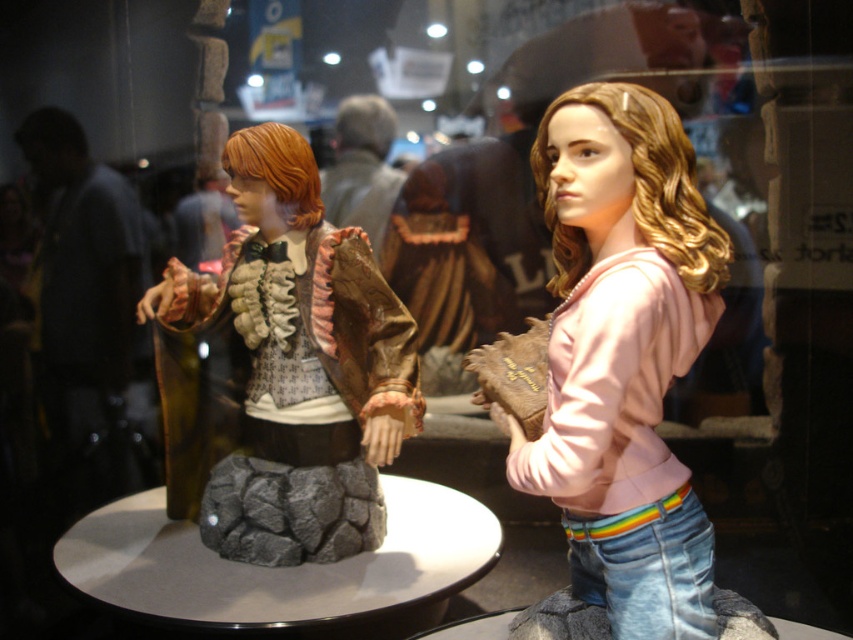
Question: Among these objects, which one is nearest to the camera?

Choices:
 (A) pink matte hoodie at center
 (B) matte brown hair at center

Answer: (A)

Question: Does pink matte hoodie at center have a smaller size compared to matte brown hair at center?

Choices:
 (A) yes
 (B) no

Answer: (A)

Question: Which point is farther to the camera?

Choices:
 (A) matte brown hair at center
 (B) pink matte hoodie at center

Answer: (A)

Question: Does pink matte hoodie at center come behind matte brown hair at center?

Choices:
 (A) yes
 (B) no

Answer: (B)

Question: Does pink matte hoodie at center appear over matte brown hair at center?

Choices:
 (A) no
 (B) yes

Answer: (B)